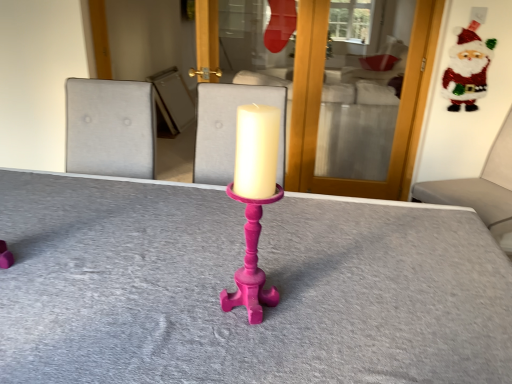
Identify the location of vacant area that is situated to the right of matte pink candle holder at center. The height and width of the screenshot is (384, 512). (329, 311).